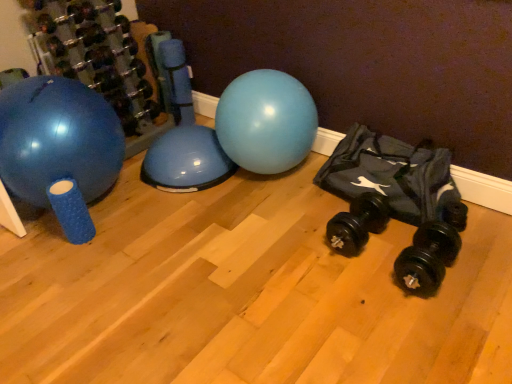
How much space does black rubber dumbbell at lower right, positioned as the first dumbbell in bottom-to-top order, occupy horizontally?

black rubber dumbbell at lower right, positioned as the first dumbbell in bottom-to-top order, is 12.47 inches wide.

Identify the location of black rubber dumbbell at lower right, placed as the second dumbbell when sorted from top to bottom. pos(358,223).

Image resolution: width=512 pixels, height=384 pixels. In order to click on black rubber dumbbell at lower right, which ranks as the first dumbbell in front-to-back order in this screenshot , I will do [426, 258].

Would you say black fabric bean bag at right is to the left or to the right of black rubber dumbbell at lower right, positioned as the 2th dumbbell in bottom-to-top order, in the picture?

black fabric bean bag at right is positioned on black rubber dumbbell at lower right, positioned as the 2th dumbbell in bottom-to-top order,'s right side.

You are a GUI agent. You are given a task and a screenshot of the screen. Output one action in this format:
    pyautogui.click(x=<x>, y=<y>)
    Task: Click on the bean bag chair located in front of the black rubber dumbbell at lower right, positioned as the 2th dumbbell in bottom-to-top order
    This screenshot has width=512, height=384.
    Given the screenshot: What is the action you would take?
    pyautogui.click(x=392, y=174)

From a real-world perspective, is black fabric bean bag at right beneath black rubber dumbbell at lower right, acting as the second dumbbell starting from the right?

No, from a real-world perspective, black fabric bean bag at right is not below black rubber dumbbell at lower right, acting as the second dumbbell starting from the right.

From a real-world perspective, between black rubber dumbbell at left, the first dumbbell positioned from the top, and black rubber dumbbell at lower right, the 3th dumbbell when ordered from left to right, who is vertically lower?

black rubber dumbbell at lower right, the 3th dumbbell when ordered from left to right, is physically lower.

In the scene shown: Does black rubber dumbbell at left, the first dumbbell positioned from the top, have a greater height compared to black rubber dumbbell at lower right, the 3th dumbbell when ordered from left to right?

Indeed, black rubber dumbbell at left, the first dumbbell positioned from the top, has a greater height compared to black rubber dumbbell at lower right, the 3th dumbbell when ordered from left to right.

I want to click on the 2nd dumbbell to the left of the black rubber dumbbell at lower right, which ranks as the first dumbbell in front-to-back order, starting your count from the anchor, so click(x=95, y=55).

From the image's perspective, who appears lower, black rubber dumbbell at left, arranged as the 1th dumbbell when viewed from the left, or black rubber dumbbell at lower right, which ranks as the first dumbbell in front-to-back order?

black rubber dumbbell at lower right, which ranks as the first dumbbell in front-to-back order.

I want to click on the 1st dumbbell below when counting from the black rubber dumbbell at left, the first dumbbell positioned from the top (from the image's perspective), so click(358, 223).

Is black rubber dumbbell at left, the first dumbbell when ordered from back to front, facing away from black rubber dumbbell at lower right, acting as the 2th dumbbell starting from the back?

No, black rubber dumbbell at left, the first dumbbell when ordered from back to front, is not facing the opposite direction of black rubber dumbbell at lower right, acting as the 2th dumbbell starting from the back.

Considering the relative sizes of black rubber dumbbell at left, arranged as the 1th dumbbell when viewed from the left, and black rubber dumbbell at lower right, the second dumbbell viewed from the front, in the image provided, is black rubber dumbbell at left, arranged as the 1th dumbbell when viewed from the left, taller than black rubber dumbbell at lower right, the second dumbbell viewed from the front,?

Indeed, black rubber dumbbell at left, arranged as the 1th dumbbell when viewed from the left, has a greater height compared to black rubber dumbbell at lower right, the second dumbbell viewed from the front.

Looking at this image, from the image's perspective, is black rubber dumbbell at left, arranged as the 1th dumbbell when viewed from the left, over black rubber dumbbell at lower right, positioned as the 2th dumbbell in bottom-to-top order?

Yes, from the image's perspective, black rubber dumbbell at left, arranged as the 1th dumbbell when viewed from the left, is above black rubber dumbbell at lower right, positioned as the 2th dumbbell in bottom-to-top order.

What's the angular difference between black rubber dumbbell at left, the third dumbbell when ordered from front to back, and black fabric bean bag at right's facing directions?

90.2 degrees.

Is black rubber dumbbell at left, the first dumbbell positioned from the top, located outside black fabric bean bag at right?

That's correct, black rubber dumbbell at left, the first dumbbell positioned from the top, is outside of black fabric bean bag at right.

Is black rubber dumbbell at left, the 3th dumbbell viewed from the right, far from black fabric bean bag at right?

black rubber dumbbell at left, the 3th dumbbell viewed from the right, is far away from black fabric bean bag at right.

From the image's perspective, is black rubber dumbbell at left, arranged as the 1th dumbbell when viewed from the left, located beneath black fabric bean bag at right?

No, from the image's perspective, black rubber dumbbell at left, arranged as the 1th dumbbell when viewed from the left, is not below black fabric bean bag at right.

Is black rubber dumbbell at lower right, positioned as the first dumbbell in bottom-to-top order, outside of black fabric bean bag at right?

Yes.

Between black rubber dumbbell at lower right, the first dumbbell in the right-to-left sequence, and black fabric bean bag at right, which one has less height?

With less height is black rubber dumbbell at lower right, the first dumbbell in the right-to-left sequence.

From a real-world perspective, between black rubber dumbbell at lower right, which ranks as the first dumbbell in front-to-back order, and black fabric bean bag at right, who is vertically higher?

In real-world perspective, black fabric bean bag at right is above.

Which object is more forward, black rubber dumbbell at lower right, which ranks as the first dumbbell in front-to-back order, or black fabric bean bag at right?

black rubber dumbbell at lower right, which ranks as the first dumbbell in front-to-back order.

Based on the photo, visually, is black rubber dumbbell at lower right, positioned as the 2th dumbbell in bottom-to-top order, positioned to the left or to the right of black fabric bean bag at right?

black rubber dumbbell at lower right, positioned as the 2th dumbbell in bottom-to-top order, is to the left of black fabric bean bag at right.

From the image's perspective, is black rubber dumbbell at lower right, the second dumbbell from the left, on top of black fabric bean bag at right?

Incorrect, from the image's perspective, black rubber dumbbell at lower right, the second dumbbell from the left, is lower than black fabric bean bag at right.

Is black rubber dumbbell at lower right, placed as the second dumbbell when sorted from top to bottom, facing away from black fabric bean bag at right?

Correct, black rubber dumbbell at lower right, placed as the second dumbbell when sorted from top to bottom, is looking away from black fabric bean bag at right.

From the picture: Is black rubber dumbbell at lower right, the 3th dumbbell when ordered from left to right, in contact with blue rubber ball at left?

There is a gap between black rubber dumbbell at lower right, the 3th dumbbell when ordered from left to right, and blue rubber ball at left.

From the picture: Could you tell me if black rubber dumbbell at lower right, the first dumbbell in the right-to-left sequence, is turned towards blue rubber ball at left?

No, black rubber dumbbell at lower right, the first dumbbell in the right-to-left sequence, does not turn towards blue rubber ball at left.

In the scene shown: From a real-world perspective, is black rubber dumbbell at lower right, the 3th dumbbell in the top-to-bottom sequence, positioned under blue rubber ball at left based on gravity?

Yes, from a real-world perspective, black rubber dumbbell at lower right, the 3th dumbbell in the top-to-bottom sequence, is beneath blue rubber ball at left.

Find the location of a particular element. bean bag chair positioned vertically above the black rubber dumbbell at lower right, the second dumbbell viewed from the front (from a real-world perspective) is located at coordinates (392, 174).

From the image's perspective, count 2nd dumbbells downward from the black rubber dumbbell at left, arranged as the 1th dumbbell when viewed from the left, and point to it. Please provide its 2D coordinates.

[(426, 258)]

From the image, which object appears to be nearer to blue rubber ball at left, black rubber dumbbell at lower right, the second dumbbell viewed from the front, or black rubber dumbbell at lower right, positioned as the first dumbbell in bottom-to-top order?

Among the two, black rubber dumbbell at lower right, the second dumbbell viewed from the front, is located nearer to blue rubber ball at left.

Based on their spatial positions, is black fabric bean bag at right or black rubber dumbbell at lower right, the second dumbbell viewed from the front, closer to blue rubber ball at left?

The object closer to blue rubber ball at left is black rubber dumbbell at lower right, the second dumbbell viewed from the front.

Based on their spatial positions, is black rubber dumbbell at lower right, the second dumbbell viewed from the front, or black rubber dumbbell at left, the third dumbbell when ordered from front to back, closer to blue rubber ball at left?

The object closer to blue rubber ball at left is black rubber dumbbell at left, the third dumbbell when ordered from front to back.

From the image, which object appears to be farther from black fabric bean bag at right, black rubber dumbbell at lower right, the second dumbbell from the left, or black rubber dumbbell at lower right, marked as the third dumbbell in a back-to-front arrangement?

black rubber dumbbell at lower right, marked as the third dumbbell in a back-to-front arrangement.

Based on their spatial positions, is black fabric bean bag at right or black rubber dumbbell at lower right, the first dumbbell in the right-to-left sequence, closer to black rubber dumbbell at lower right, the second dumbbell from the left?

Based on the image, black fabric bean bag at right appears to be nearer to black rubber dumbbell at lower right, the second dumbbell from the left.

Consider the image. Looking at the image, which one is located further to black rubber dumbbell at lower right, placed as the second dumbbell when sorted from top to bottom, black rubber dumbbell at left, the third dumbbell ordered from the bottom, or black rubber dumbbell at lower right, which ranks as the first dumbbell in front-to-back order?

The object further to black rubber dumbbell at lower right, placed as the second dumbbell when sorted from top to bottom, is black rubber dumbbell at left, the third dumbbell ordered from the bottom.

Considering their positions, is black rubber dumbbell at lower right, the 3th dumbbell in the top-to-bottom sequence, positioned further to black fabric bean bag at right than black rubber dumbbell at lower right, acting as the second dumbbell starting from the right?

black rubber dumbbell at lower right, the 3th dumbbell in the top-to-bottom sequence.

Based on their spatial positions, is black rubber dumbbell at lower right, marked as the third dumbbell in a back-to-front arrangement, or black rubber dumbbell at lower right, placed as the second dumbbell when sorted from top to bottom, further from black rubber dumbbell at left, the first dumbbell when ordered from back to front?

Based on the image, black rubber dumbbell at lower right, marked as the third dumbbell in a back-to-front arrangement, appears to be further to black rubber dumbbell at left, the first dumbbell when ordered from back to front.

Where is `dumbbell between black rubber dumbbell at left, the first dumbbell positioned from the top, and black rubber dumbbell at lower right, positioned as the first dumbbell in bottom-to-top order, in the horizontal direction`? dumbbell between black rubber dumbbell at left, the first dumbbell positioned from the top, and black rubber dumbbell at lower right, positioned as the first dumbbell in bottom-to-top order, in the horizontal direction is located at coordinates (358, 223).

Find the location of `dumbbell between blue rubber ball at left and black rubber dumbbell at lower right, positioned as the 2th dumbbell in bottom-to-top order`. dumbbell between blue rubber ball at left and black rubber dumbbell at lower right, positioned as the 2th dumbbell in bottom-to-top order is located at coordinates (95, 55).

Locate an element on the screen. dumbbell between black fabric bean bag at right and black rubber dumbbell at lower right, which ranks as the first dumbbell in front-to-back order, in the up-down direction is located at coordinates 358,223.